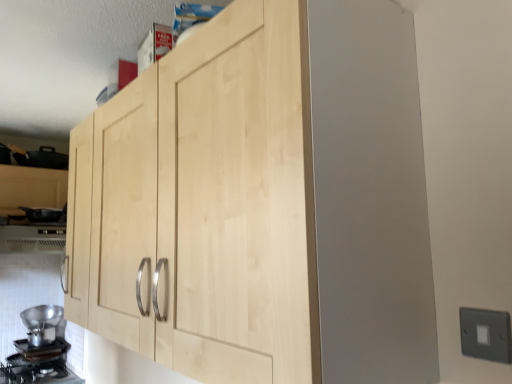
Question: Based on their positions, is black matte gas stove at lower left located to the left or right of metallic silver vent at lower left?

Choices:
 (A) right
 (B) left

Answer: (A)

Question: Is black matte gas stove at lower left wider or thinner than metallic silver vent at lower left?

Choices:
 (A) wide
 (B) thin

Answer: (A)

Question: Which object is the farthest from the black matte gas stove at lower left?

Choices:
 (A) gray plastic switch at lower right
 (B) natural wood cabinet at center
 (C) metallic silver vent at lower left
 (D) metallic silver funnel at lower left

Answer: (A)

Question: Estimate the real-world distances between objects in this image. Which object is closer to the metallic silver vent at lower left?

Choices:
 (A) gray plastic switch at lower right
 (B) black matte gas stove at lower left
 (C) metallic silver funnel at lower left
 (D) natural wood cabinet at center

Answer: (C)